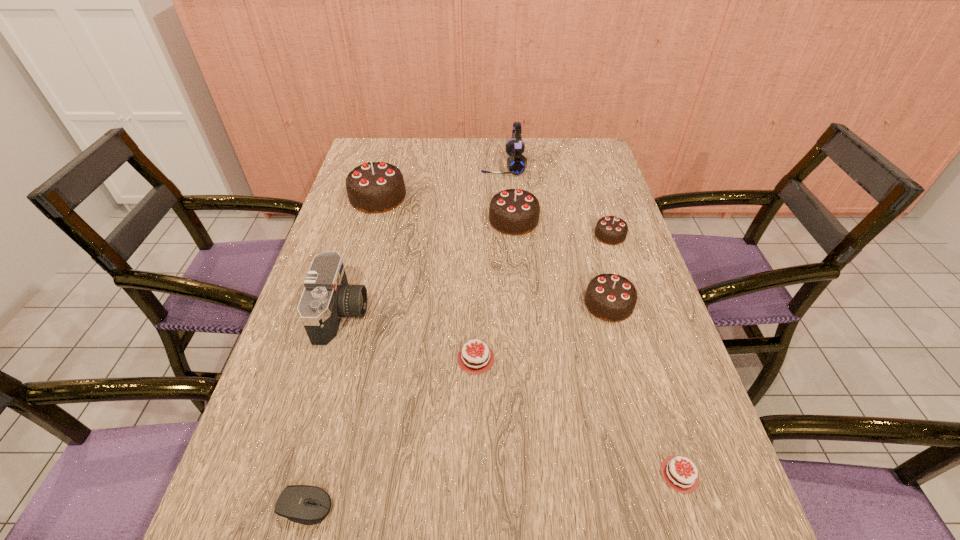
Identify the location of free location located 0.140m on the front of the second tallest chocolate cake. (518, 270).

Identify the location of vacant region located 0.230m on the back of the fifth shortest chocolate cake. The height and width of the screenshot is (540, 960). (588, 230).

Image resolution: width=960 pixels, height=540 pixels. Identify the location of vacant space located 0.120m on the left of the fourth tallest chocolate cake. (552, 235).

The width and height of the screenshot is (960, 540). I want to click on vacant space situated 0.100m on the front of the biggest red chocolate cake, so click(x=475, y=448).

In order to click on free space located on the back of the second nearest red chocolate cake in this screenshot , I will do `click(655, 396)`.

In order to click on vacant space located on the back of the computer equipment in this screenshot , I will do `click(349, 336)`.

What are the coordinates of `object at the far edge` in the screenshot? It's located at [x=516, y=163].

At what (x,y) coordinates should I click in order to perform the action: click on chocolate cake positioned at the left edge. Please return your answer as a coordinate pair (x, y). Image resolution: width=960 pixels, height=540 pixels. Looking at the image, I should click on (375, 187).

In order to click on camera located at the left edge in this screenshot , I will do `click(327, 297)`.

Find the location of `computer equipment that is at the left edge`. computer equipment that is at the left edge is located at coordinates (308, 505).